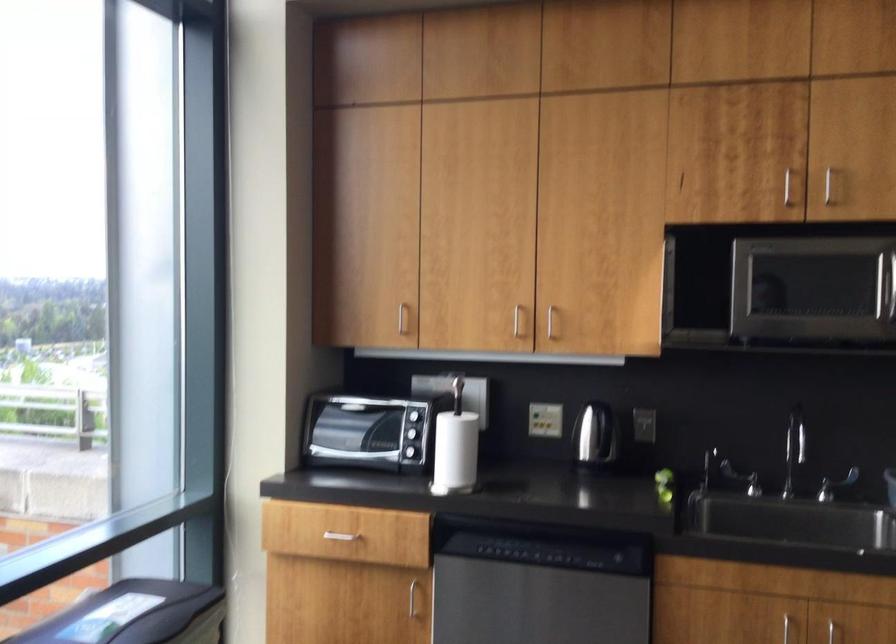
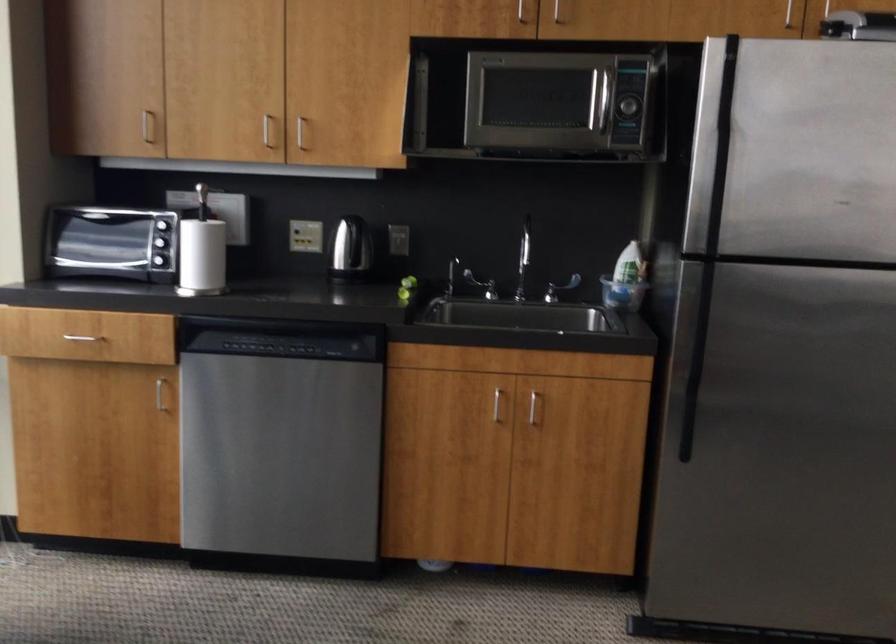
Locate, in the second image, the point that corresponds to point 526,550 in the first image.

(277, 346)